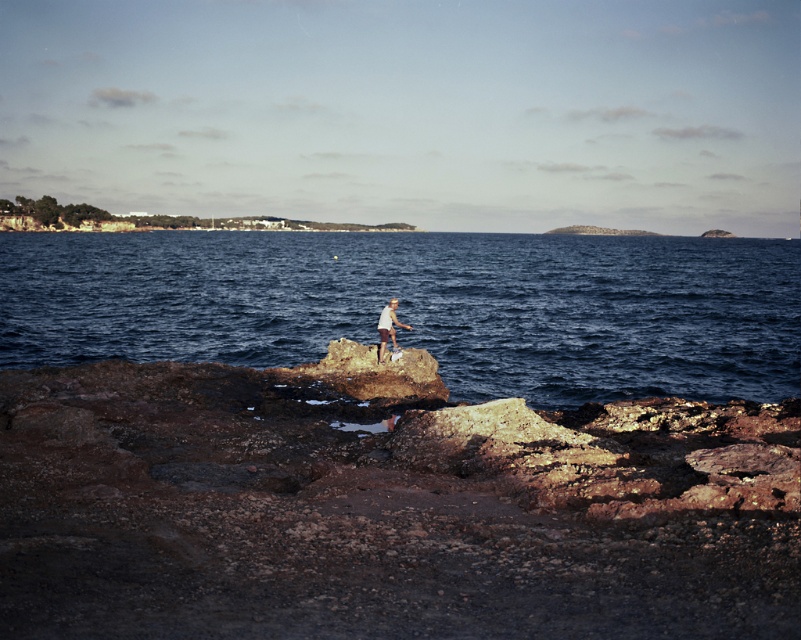
Can you confirm if blue water at center is taller than white cotton shirt at center?

Yes.

Is point (433, 248) positioned in front of point (377, 323)?

No, (433, 248) is further to viewer.

This screenshot has height=640, width=801. What do you see at coordinates (421, 307) in the screenshot?
I see `blue water at center` at bounding box center [421, 307].

The image size is (801, 640). I want to click on blue water at center, so click(421, 307).

Which of these two, rusty rock at center or white cotton shirt at center, stands shorter?

rusty rock at center is shorter.

Does rusty rock at center appear under white cotton shirt at center?

Correct, rusty rock at center is located below white cotton shirt at center.

The height and width of the screenshot is (640, 801). I want to click on rusty rock at center, so [x=384, y=508].

Is rusty rock at center smaller than blue water at center?

Yes, rusty rock at center is smaller than blue water at center.

Locate an element on the screen. The image size is (801, 640). rusty rock at center is located at coordinates (384, 508).

Locate an element on the screen. rusty rock at center is located at coordinates (384, 508).